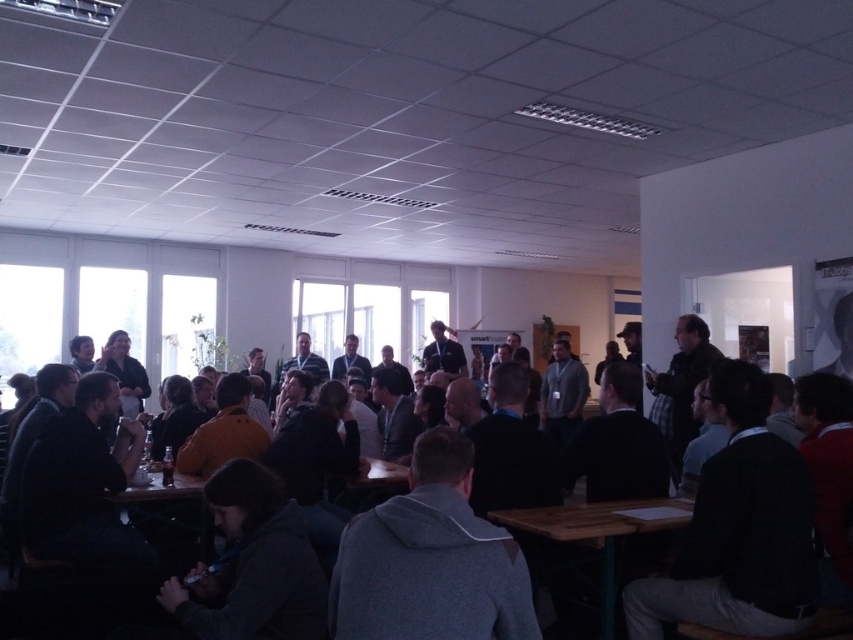
You are a participant in the meeting and need to place a laptop on the wooden table at lower center. However, there is a dark gray hoodie at center in the way. Can you still place the laptop there?

The dark gray hoodie at center is positioned over wooden table at lower center, so placing the laptop there might not be possible due to the hoodie blocking the space.

You are standing at the entrance of the conference room and see the dark gray hoodie at center and the wooden table at lower center. Which object is closer to the entrance?

The wooden table at lower center is closer to the entrance because the dark gray hoodie at center is to the right of it, implying the table is between the entrance and the hoodie.